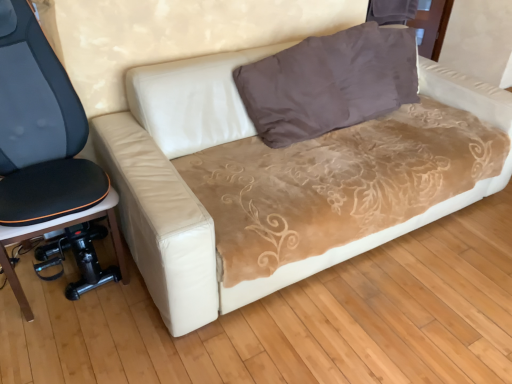
Measure the distance between point (167, 182) and camera.

Point (167, 182) is 4.90 feet away from camera.

I want to click on black fabric office chair at left, so coord(42,142).

Based on the photo, from a real-world perspective, is black fabric office chair at left on top of beige suede couch at center?

Yes.

Is black fabric office chair at left looking in the opposite direction of beige suede couch at center?

No.

Between black fabric office chair at left and beige suede couch at center, which one has more height?

With more height is black fabric office chair at left.

Looking at the image, does beige suede couch at center seem bigger or smaller compared to brown velvety pillow at upper center?

beige suede couch at center is bigger than brown velvety pillow at upper center.

Is brown velvety pillow at upper center a part of beige suede couch at center?

Yes, brown velvety pillow at upper center is a part of beige suede couch at center.

From the image's perspective, who appears lower, beige suede couch at center or brown velvety pillow at upper center?

From the image's view, beige suede couch at center is below.

Is beige suede couch at center in front of or behind brown velvety pillow at upper center in the image?

beige suede couch at center is positioned closer to the viewer than brown velvety pillow at upper center.

Is black fabric office chair at left inside beige suede couch at center?

Definitely not — black fabric office chair at left is not inside beige suede couch at center.

From the image's perspective, is beige suede couch at center above or below black fabric office chair at left?

Based on their image positions, beige suede couch at center is located above black fabric office chair at left.

In the scene shown: Is beige suede couch at center in front of or behind black fabric office chair at left in the image?

beige suede couch at center is in front of black fabric office chair at left.

Which is farther from the camera, (286, 127) or (200, 217)?

The point (286, 127) is farther.

Would you say beige suede couch at center is part of brown velvety pillow at upper center's contents?

No, beige suede couch at center is located outside of brown velvety pillow at upper center.

Which of these two, brown velvety pillow at upper center or beige suede couch at center, is bigger?

beige suede couch at center is bigger.

Considering the sizes of objects black fabric office chair at left and brown velvety pillow at upper center in the image provided, who is taller, black fabric office chair at left or brown velvety pillow at upper center?

With more height is black fabric office chair at left.

In terms of width, does black fabric office chair at left look wider or thinner when compared to brown velvety pillow at upper center?

In the image, black fabric office chair at left appears to be wider than brown velvety pillow at upper center.

Is black fabric office chair at left facing away from brown velvety pillow at upper center?

No, black fabric office chair at left is not facing away from brown velvety pillow at upper center.

Is black fabric office chair at left positioned far away from brown velvety pillow at upper center?

Yes, black fabric office chair at left and brown velvety pillow at upper center are located far from each other.

Considering the sizes of brown velvety pillow at upper center and black fabric office chair at left in the image, is brown velvety pillow at upper center wider or thinner than black fabric office chair at left?

Clearly, brown velvety pillow at upper center has less width compared to black fabric office chair at left.

Which of these two, brown velvety pillow at upper center or black fabric office chair at left, stands taller?

With more height is black fabric office chair at left.

Which object is further away from the camera taking this photo, brown velvety pillow at upper center or black fabric office chair at left?

brown velvety pillow at upper center is further from the camera.

In the scene shown: Is black fabric office chair at left completely or partially inside brown velvety pillow at upper center?

Definitely not — black fabric office chair at left is not inside brown velvety pillow at upper center.

The image size is (512, 384). In order to click on studio couch on the right side of black fabric office chair at left in this screenshot , I will do `click(195, 195)`.

Find the location of a particular element. Image resolution: width=512 pixels, height=384 pixels. studio couch on the left of brown velvety pillow at upper center is located at coordinates (195, 195).

When comparing their distances from beige suede couch at center, does black fabric office chair at left or brown velvety pillow at upper center seem further?

black fabric office chair at left is positioned further to the anchor beige suede couch at center.

From the image, which object appears to be nearer to black fabric office chair at left, beige suede couch at center or brown velvety pillow at upper center?

Among the two, beige suede couch at center is located nearer to black fabric office chair at left.

When comparing their distances from black fabric office chair at left, does brown velvety pillow at upper center or beige suede couch at center seem further?

Among the two, brown velvety pillow at upper center is located further to black fabric office chair at left.

Considering their positions, is beige suede couch at center positioned further to brown velvety pillow at upper center than black fabric office chair at left?

The object further to brown velvety pillow at upper center is black fabric office chair at left.

Estimate the real-world distances between objects in this image. Which object is further from brown velvety pillow at upper center, black fabric office chair at left or beige suede couch at center?

The object further to brown velvety pillow at upper center is black fabric office chair at left.

In the scene shown: Which object lies nearer to the anchor point beige suede couch at center, brown velvety pillow at upper center or black fabric office chair at left?

brown velvety pillow at upper center.

What are the coordinates of `studio couch located between black fabric office chair at left and brown velvety pillow at upper center in the left-right direction` in the screenshot? It's located at (195, 195).